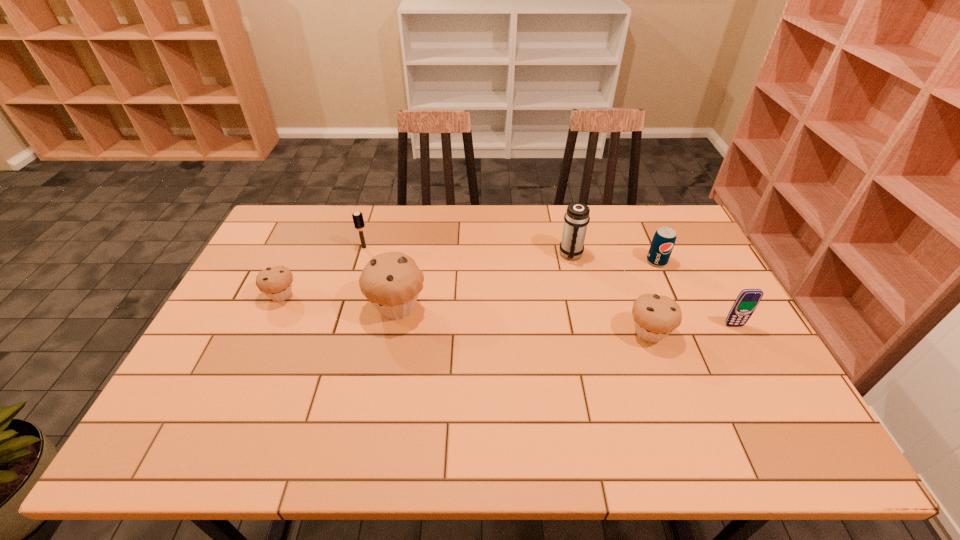
This screenshot has height=540, width=960. Identify the location of pop located in the right edge section of the desktop. (664, 239).

Find the location of a particular element. The image size is (960, 540). cellular telephone located in the right edge section of the desktop is located at coordinates (745, 304).

Identify the location of vacant space at the far edge of the desktop. (425, 221).

Where is `vacant space at the near edge of the desktop`? This screenshot has height=540, width=960. vacant space at the near edge of the desktop is located at coordinates (690, 389).

Where is `vacant region at the left edge of the desktop`? Image resolution: width=960 pixels, height=540 pixels. vacant region at the left edge of the desktop is located at coordinates (262, 260).

Image resolution: width=960 pixels, height=540 pixels. I want to click on free region at the far left corner, so click(x=306, y=238).

At what (x,y) coordinates should I click in order to perform the action: click on free location at the near left corner of the desktop. Please return your answer as a coordinate pair (x, y). The image size is (960, 540). Looking at the image, I should click on (205, 388).

Where is `free point at the far right corner`? This screenshot has height=540, width=960. free point at the far right corner is located at coordinates (638, 209).

Locate an element on the screen. The image size is (960, 540). free space between the fifth object from right to left and the fourth object from right to left is located at coordinates (484, 281).

The width and height of the screenshot is (960, 540). I want to click on empty space that is in between the shortest muffin and the tallest muffin, so click(x=339, y=301).